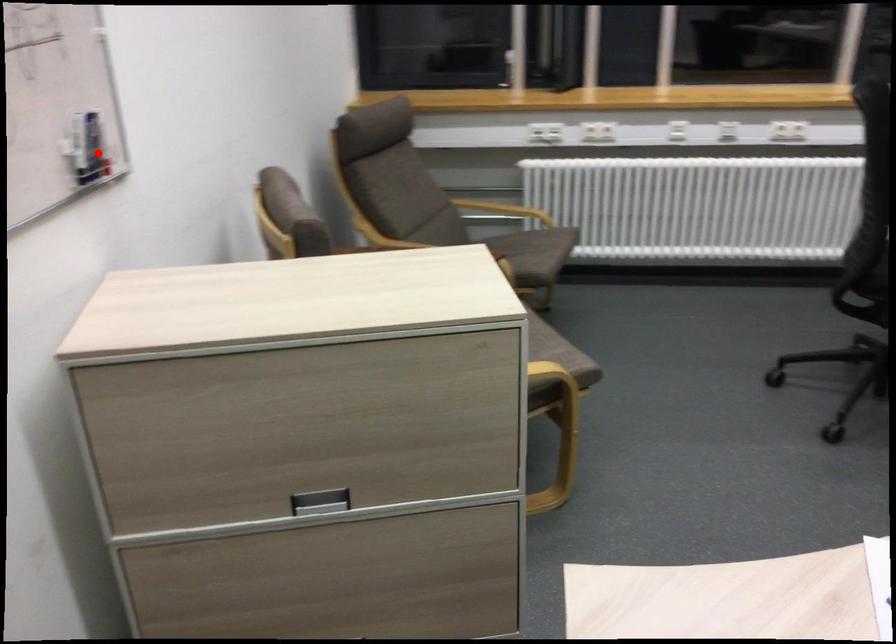
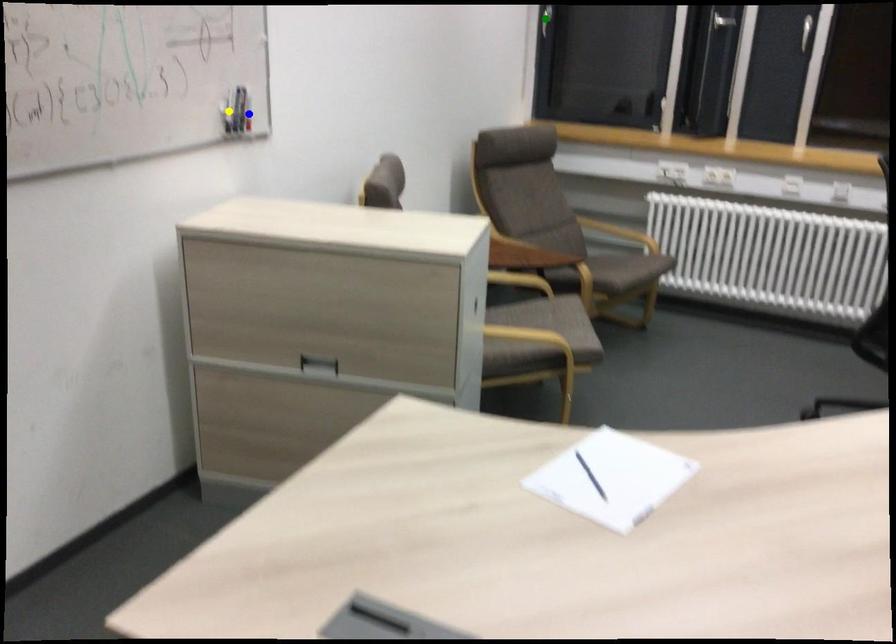
Question: I am providing you with two images of the same scene from different viewpoints. A red point is marked on the first image. You are given multiple points on the second image. Which point in image 2 represents the same 3d spot as the red point in image 1?

Choices:
 (A) yellow point
 (B) green point
 (C) blue point

Answer: (C)